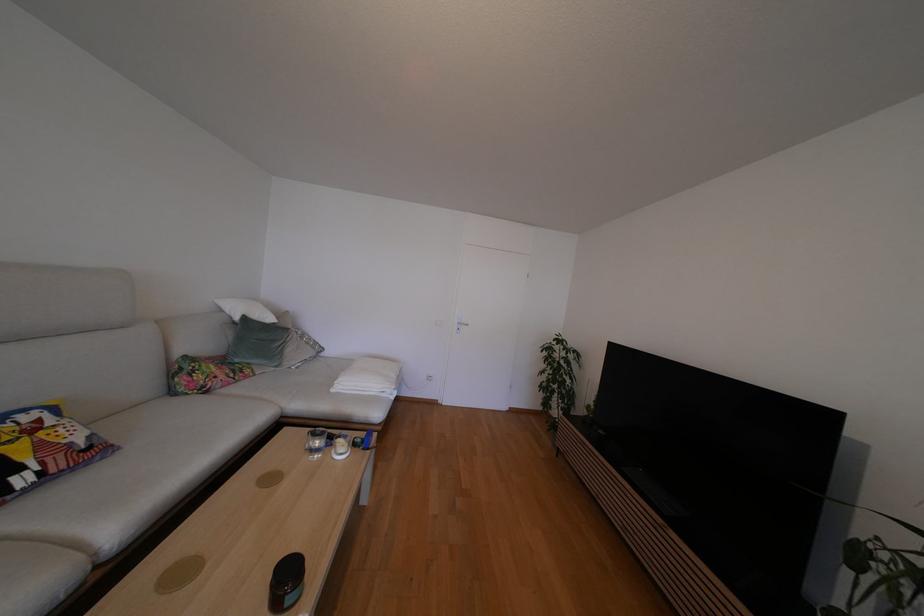
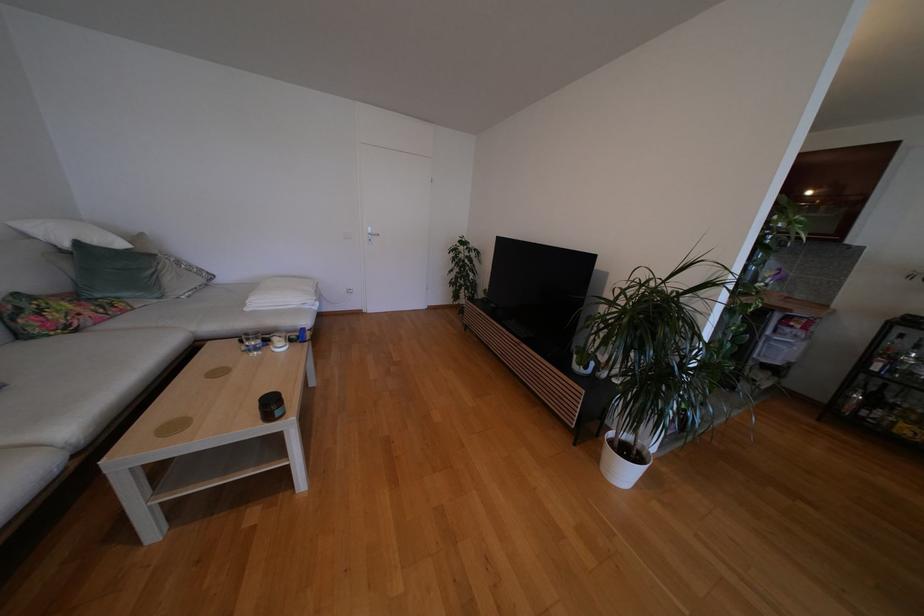
Question: The images are taken continuously from a first-person perspective. In which direction are you moving?

Choices:
 (A) Left
 (B) Right
 (C) Forward
 (D) Backward

Answer: (D)